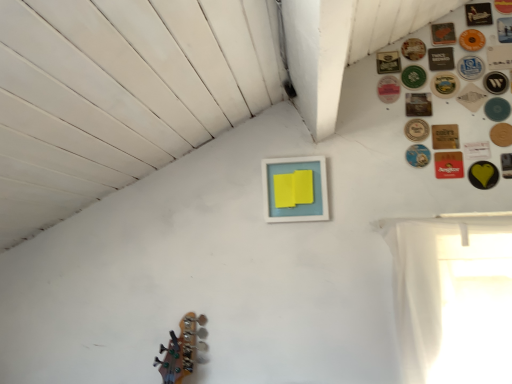
Where is `white paper button at upper right, which is the eleventh button in bottom-to-top order`? The image size is (512, 384). white paper button at upper right, which is the eleventh button in bottom-to-top order is located at coordinates (472, 97).

Where is `brown leather coaster at upper right, the 23th button from the top`? This screenshot has height=384, width=512. brown leather coaster at upper right, the 23th button from the top is located at coordinates (448, 165).

Measure the distance between point (431, 113) and camera.

1.59 meters.

The height and width of the screenshot is (384, 512). What do you see at coordinates (444, 85) in the screenshot?
I see `green matte coaster at upper right, acting as the thirteenth button starting from the top` at bounding box center [444, 85].

Locate an element on the screen. The height and width of the screenshot is (384, 512). green matte button at upper right, the 17th button in the bottom-to-top sequence is located at coordinates (388, 62).

Which object is closer to the camera, orange matte button at upper right, which appears as the fifth button when viewed from the top, or green matte button at upper right, the seventeenth button viewed from the top?

green matte button at upper right, the seventeenth button viewed from the top, is closer to the camera.

From a real-world perspective, who is located higher, orange matte button at upper right, which appears as the fifth button when viewed from the top, or green matte button at upper right, the ninth button positioned from the bottom?

From a 3D spatial view, orange matte button at upper right, which appears as the fifth button when viewed from the top, is above.

How many degrees apart are the facing directions of orange matte button at upper right, which appears as the fifth button when viewed from the top, and green matte button at upper right, the ninth button positioned from the bottom?

There is a 0.000469-degree angle between the facing directions of orange matte button at upper right, which appears as the fifth button when viewed from the top, and green matte button at upper right, the ninth button positioned from the bottom.

Between orange matte button at upper right, which appears as the 21th button when ordered from the bottom, and green matte button at upper right, the ninth button positioned from the bottom, which one has more height?

orange matte button at upper right, which appears as the 21th button when ordered from the bottom.

Is gold metallic button at upper right, the 8th button from the bottom, surrounded by black leather button at upper right, the 2th button from the top?

No, gold metallic button at upper right, the 8th button from the bottom, is not surrounded by black leather button at upper right, the 2th button from the top.

From the image's perspective, between black leather button at upper right, the 2th button from the top, and gold metallic button at upper right, which is the eighteenth button in top-to-bottom order, which one is located above?

black leather button at upper right, the 2th button from the top, is shown above in the image.

Considering the relative sizes of black leather button at upper right, the 24th button when ordered from bottom to top, and gold metallic button at upper right, the 8th button from the bottom, in the image provided, is black leather button at upper right, the 24th button when ordered from bottom to top, bigger than gold metallic button at upper right, the 8th button from the bottom,?

No.

Could blue fabric coaster at upper right, which ranks as the 16th button in bottom-to-top order, be considered to be inside white matte button at upper right, positioned as the twelfth button in top-to-bottom order?

No.

In the scene shown: Considering the relative sizes of white matte button at upper right, positioned as the twelfth button in top-to-bottom order, and blue fabric coaster at upper right, which ranks as the 16th button in bottom-to-top order, in the image provided, is white matte button at upper right, positioned as the twelfth button in top-to-bottom order, wider than blue fabric coaster at upper right, which ranks as the 16th button in bottom-to-top order,?

Yes, white matte button at upper right, positioned as the twelfth button in top-to-bottom order, is wider than blue fabric coaster at upper right, which ranks as the 16th button in bottom-to-top order.

From the image's perspective, is white matte button at upper right, acting as the fourteenth button starting from the bottom, above or below blue fabric coaster at upper right, the 10th button viewed from the top?

white matte button at upper right, acting as the fourteenth button starting from the bottom, is situated lower than blue fabric coaster at upper right, the 10th button viewed from the top, in the image.

Considering the points (492, 86) and (476, 59), which point is in front, point (492, 86) or point (476, 59)?

Positioned in front is point (492, 86).

Can we say gold metallic button at upper right, which is the eighteenth button in top-to-bottom order, lies outside matte brown coaster at upper right, the 12th button in the bottom-to-top sequence?

Yes.

Is gold metallic button at upper right, the 8th button from the bottom, in front of or behind matte brown coaster at upper right, the 12th button in the bottom-to-top sequence, in the image?

Clearly, gold metallic button at upper right, the 8th button from the bottom, is in front of matte brown coaster at upper right, the 12th button in the bottom-to-top sequence.

Consider the image. From a real-world perspective, is gold metallic button at upper right, which is the eighteenth button in top-to-bottom order, over matte brown coaster at upper right, the 12th button in the bottom-to-top sequence?

No.

From the picture: Is metallic blue button at upper right, the 4th button positioned from the bottom, oriented towards orange matte coaster at upper right, the 22th button positioned from the bottom?

No, metallic blue button at upper right, the 4th button positioned from the bottom, is not oriented towards orange matte coaster at upper right, the 22th button positioned from the bottom.

Is metallic blue button at upper right, placed as the 22th button when sorted from top to bottom, positioned beyond the bounds of orange matte coaster at upper right, placed as the fourth button when sorted from top to bottom?

That's correct, metallic blue button at upper right, placed as the 22th button when sorted from top to bottom, is outside of orange matte coaster at upper right, placed as the fourth button when sorted from top to bottom.

Can you confirm if metallic blue button at upper right, placed as the 22th button when sorted from top to bottom, is bigger than orange matte coaster at upper right, placed as the fourth button when sorted from top to bottom?

No, metallic blue button at upper right, placed as the 22th button when sorted from top to bottom, is not bigger than orange matte coaster at upper right, placed as the fourth button when sorted from top to bottom.

Is point (420, 165) farther from viewer compared to point (447, 41)?

That is False.

Is wooden coaster at upper right, which ranks as the sixth button in top-to-bottom order, looking in the opposite direction of orange matte coaster at upper right, placed as the fourth button when sorted from top to bottom?

No, wooden coaster at upper right, which ranks as the sixth button in top-to-bottom order, is not facing away from orange matte coaster at upper right, placed as the fourth button when sorted from top to bottom.

Choose the correct answer: Is wooden coaster at upper right, which ranks as the 20th button in bottom-to-top order, inside orange matte coaster at upper right, placed as the fourth button when sorted from top to bottom, or outside it?

wooden coaster at upper right, which ranks as the 20th button in bottom-to-top order, exists outside the volume of orange matte coaster at upper right, placed as the fourth button when sorted from top to bottom.

Between wooden coaster at upper right, which ranks as the 20th button in bottom-to-top order, and orange matte coaster at upper right, the 22th button positioned from the bottom, which one has larger size?

With larger size is wooden coaster at upper right, which ranks as the 20th button in bottom-to-top order.

From a real-world perspective, is wooden coaster at upper right, which ranks as the sixth button in top-to-bottom order, above or below orange matte coaster at upper right, placed as the fourth button when sorted from top to bottom?

wooden coaster at upper right, which ranks as the sixth button in top-to-bottom order, is below orange matte coaster at upper right, placed as the fourth button when sorted from top to bottom.

Is yellow matte heart at upper right, positioned as the 24th button in top-to-bottom order, taller than wooden coaster at upper right, positioned as the 6th button in bottom-to-top order?

No.

Can you confirm if yellow matte heart at upper right, placed as the second button when sorted from bottom to top, is positioned to the right of wooden coaster at upper right, positioned as the 6th button in bottom-to-top order?

Yes, yellow matte heart at upper right, placed as the second button when sorted from bottom to top, is to the right of wooden coaster at upper right, positioned as the 6th button in bottom-to-top order.

Considering the points (511, 174) and (490, 133), which point is in front, point (511, 174) or point (490, 133)?

Positioned in front is point (511, 174).

I want to click on the 4th button above the yellow matte heart at upper right, positioned as the 24th button in top-to-bottom order (from the image's perspective), so click(501, 134).

You are a GUI agent. You are given a task and a screenshot of the screen. Output one action in this format:
    pyautogui.click(x=<x>, y=<y>)
    Task: Click on the 11th button behind the green matte button at upper right, the seventeenth button viewed from the top, starting your count from the anchor
    
    Given the screenshot: What is the action you would take?
    pyautogui.click(x=472, y=40)

Find the location of a particular element. button that is the 16th one below the black leather button at upper right, the 2th button from the top (from a real-world perspective) is located at coordinates (416, 130).

When comparing their distances from orange matte coaster at upper right, placed as the fourth button when sorted from top to bottom, does brown leather coaster at upper right, placed as the 3th button when sorted from bottom to top, or white matte button at upper right, which ranks as the 21th button in top-to-bottom order, seem further?

Among the two, brown leather coaster at upper right, placed as the 3th button when sorted from bottom to top, is located further to orange matte coaster at upper right, placed as the fourth button when sorted from top to bottom.

Estimate the real-world distances between objects in this image. Which object is further from black leather button at upper right, the 2th button from the top, wooden coaster at upper right, positioned as the 6th button in bottom-to-top order, or white matte coaster at upper right, placed as the 8th button when sorted from top to bottom?

wooden coaster at upper right, positioned as the 6th button in bottom-to-top order, lies further to black leather button at upper right, the 2th button from the top, than the other object.

When comparing their distances from white matte button at upper right, acting as the fourteenth button starting from the bottom, does yellow matte heart at upper right, positioned as the first button in bottom-to-top order, or orange matte coaster at upper right, the 22th button positioned from the bottom, seem closer?

Among the two, orange matte coaster at upper right, the 22th button positioned from the bottom, is located nearer to white matte button at upper right, acting as the fourteenth button starting from the bottom.

When comparing their distances from gold metallic button at upper right, the 8th button from the bottom, does orange matte coaster at upper right, the 22th button positioned from the bottom, or brown leather coaster at upper right, positioned as the 19th button in top-to-bottom order, seem further?

Among the two, orange matte coaster at upper right, the 22th button positioned from the bottom, is located further to gold metallic button at upper right, the 8th button from the bottom.

When comparing their distances from black leather button at upper right, the 2th button from the top, does green matte button at upper right, placed as the ninth button when sorted from top to bottom, or matte black button at upper right, which appears as the seventh button when viewed from the top, seem further?

green matte button at upper right, placed as the ninth button when sorted from top to bottom, lies further to black leather button at upper right, the 2th button from the top, than the other object.

Estimate the real-world distances between objects in this image. Which object is further from wooden coaster at upper right, which is the first button from top to bottom, wooden coaster at upper right, which ranks as the sixth button in top-to-bottom order, or yellow matte heart at upper right, positioned as the first button in bottom-to-top order?

yellow matte heart at upper right, positioned as the first button in bottom-to-top order, is positioned further to the anchor wooden coaster at upper right, which is the first button from top to bottom.

Looking at the image, which one is located further to green matte button at upper right, the ninth button positioned from the bottom, metallic blue button at upper right, placed as the 22th button when sorted from top to bottom, or matte black button at upper right, which is counted as the nineteenth button, starting from the bottom?

Based on the image, metallic blue button at upper right, placed as the 22th button when sorted from top to bottom, appears to be further to green matte button at upper right, the ninth button positioned from the bottom.

Estimate the real-world distances between objects in this image. Which object is closer to white matte button at upper right, positioned as the twelfth button in top-to-bottom order, brown leather coaster at upper right, the 23th button from the top, or wooden coaster at upper right, positioned as the 6th button in bottom-to-top order?

wooden coaster at upper right, positioned as the 6th button in bottom-to-top order, lies closer to white matte button at upper right, positioned as the twelfth button in top-to-bottom order, than the other object.

Identify the location of picture frame between green matte button at upper right, the 17th button in the bottom-to-top sequence, and white sheer curtain at right in the up-down direction. Image resolution: width=512 pixels, height=384 pixels. (296, 189).

Locate an element on the screen. This screenshot has width=512, height=384. window screen between matte blue picture frame at center and white matte button at upper right, which ranks as the 21th button in top-to-bottom order, in the horizontal direction is located at coordinates (452, 298).

Where is `picture frame between wooden coaster at upper right, which ranks as the 20th button in bottom-to-top order, and white sheer curtain at right in the up-down direction`? picture frame between wooden coaster at upper right, which ranks as the 20th button in bottom-to-top order, and white sheer curtain at right in the up-down direction is located at coordinates (296, 189).

The image size is (512, 384). I want to click on picture frame between blue fabric coaster at upper right, the 10th button viewed from the top, and white sheer curtain at right vertically, so click(296, 189).